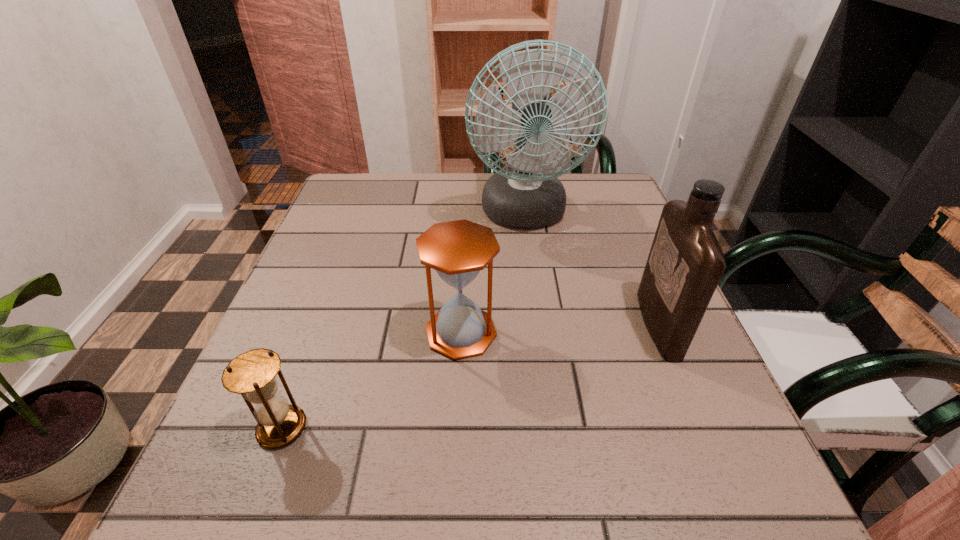
Identify the location of vacant point located between the right hourglass and the nearer hourglass. The image size is (960, 540). (372, 380).

You are a GUI agent. You are given a task and a screenshot of the screen. Output one action in this format:
    pyautogui.click(x=<x>, y=<y>)
    Task: Click on the free space between the leftmost object and the second shortest object
    
    Given the screenshot: What is the action you would take?
    pyautogui.click(x=372, y=380)

Locate an element on the screen. The height and width of the screenshot is (540, 960). vacant space in between the rightmost object and the tallest object is located at coordinates (591, 269).

The image size is (960, 540). What are the coordinates of `free spot between the right hourglass and the leftmost object` in the screenshot? It's located at (372, 380).

You are a GUI agent. You are given a task and a screenshot of the screen. Output one action in this format:
    pyautogui.click(x=<x>, y=<y>)
    Task: Click on the object that stands as the closest to the second shortest object
    This screenshot has width=960, height=540.
    Given the screenshot: What is the action you would take?
    pyautogui.click(x=252, y=374)

Locate an element on the screen. The height and width of the screenshot is (540, 960). object that is the second closest to the rightmost object is located at coordinates (458, 250).

Image resolution: width=960 pixels, height=540 pixels. Find the location of `vacant position in the image that satisfies the following two spatial constraints: 1. on the label side of the rightmost object; 2. on the front side of the leftmost object`. vacant position in the image that satisfies the following two spatial constraints: 1. on the label side of the rightmost object; 2. on the front side of the leftmost object is located at coordinates (702, 428).